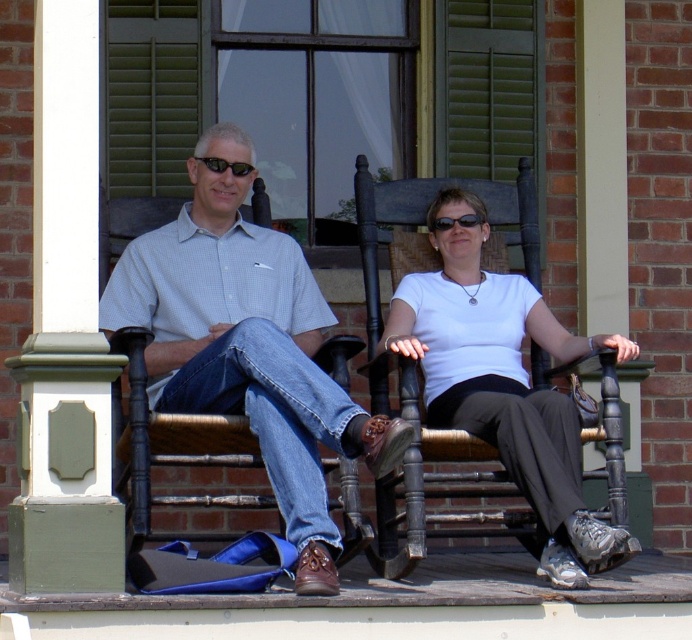
You are standing on the porch and need to find the light blue checkered shirt at center. According to the coordinates, where would you look?

The light blue checkered shirt at center is located at the coordinates point (246, 346).

You are standing on the porch and want to pick up the light blue checkered shirt at center and the white matte shirt at center. Which one do you need to bend down more to pick up?

The light blue checkered shirt at center is closer to the viewer than the white matte shirt at center, so you would need to bend down more to pick up the light blue checkered shirt at center.